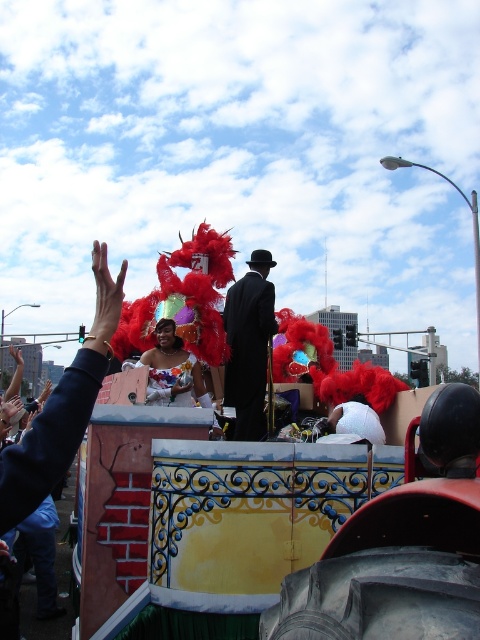
Question: Considering the relative positions of black satin suit at center and matte white dress at center in the image provided, where is black satin suit at center located with respect to matte white dress at center?

Choices:
 (A) left
 (B) right

Answer: (B)

Question: Which object appears farthest from the camera in this image?

Choices:
 (A) matte white dress at center
 (B) black satin suit at center

Answer: (B)

Question: Which point is farther to the camera?

Choices:
 (A) matte white dress at center
 (B) black satin suit at center

Answer: (B)

Question: Can you confirm if black satin suit at center is positioned below matte white dress at center?

Choices:
 (A) yes
 (B) no

Answer: (B)

Question: Is black satin suit at center thinner than matte white dress at center?

Choices:
 (A) yes
 (B) no

Answer: (A)

Question: Which object is closer to the camera taking this photo?

Choices:
 (A) matte white dress at center
 (B) black satin suit at center

Answer: (A)